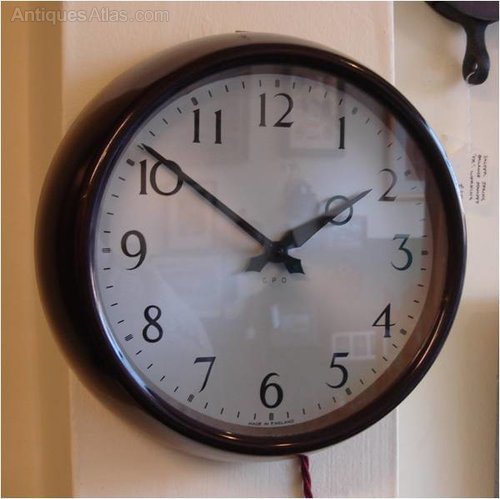
What are the coordinates of `black metallic clock hands` in the screenshot? It's located at (227, 212), (312, 225).